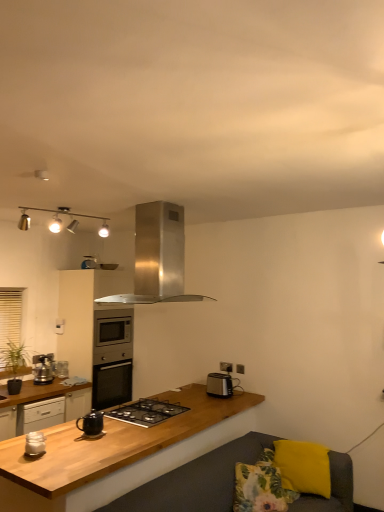
Question: Should I look upward or downward to see black glass gas stove at center?

Choices:
 (A) down
 (B) up

Answer: (A)

Question: Can you confirm if matte black kettle at center is positioned to the left of floral fabric pillow at lower right, which appears as the 2th pillow when viewed from the right?

Choices:
 (A) yes
 (B) no

Answer: (A)

Question: Does matte black kettle at center have a smaller size compared to floral fabric pillow at lower right, which appears as the 2th pillow when viewed from the right?

Choices:
 (A) no
 (B) yes

Answer: (B)

Question: Considering the relative sizes of matte black kettle at center and floral fabric pillow at lower right, which appears as the 2th pillow when viewed from the right, in the image provided, is matte black kettle at center thinner than floral fabric pillow at lower right, which appears as the 2th pillow when viewed from the right,?

Choices:
 (A) yes
 (B) no

Answer: (A)

Question: Is matte black kettle at center placed right next to floral fabric pillow at lower right, which appears as the 2th pillow when viewed from the right?

Choices:
 (A) no
 (B) yes

Answer: (A)

Question: Does matte black kettle at center appear on the right side of floral fabric pillow at lower right, which appears as the 2th pillow when viewed from the right?

Choices:
 (A) no
 (B) yes

Answer: (A)

Question: From the image's perspective, is matte black kettle at center on top of floral fabric pillow at lower right, marked as the first pillow in a left-to-right arrangement?

Choices:
 (A) yes
 (B) no

Answer: (A)

Question: Can you confirm if satin silver oven at center, which is counted as the second cabinetry, starting from the front, is positioned to the left of black glass gas stove at center?

Choices:
 (A) yes
 (B) no

Answer: (A)

Question: Can you confirm if satin silver oven at center, which is counted as the second cabinetry, starting from the front, is thinner than black glass gas stove at center?

Choices:
 (A) yes
 (B) no

Answer: (B)

Question: Is the depth of satin silver oven at center, which is counted as the second cabinetry, starting from the front, less than that of black glass gas stove at center?

Choices:
 (A) no
 (B) yes

Answer: (A)

Question: Considering the relative sizes of satin silver oven at center, which is counted as the second cabinetry, starting from the front, and black glass gas stove at center in the image provided, is satin silver oven at center, which is counted as the second cabinetry, starting from the front, smaller than black glass gas stove at center?

Choices:
 (A) yes
 (B) no

Answer: (B)

Question: From a real-world perspective, is satin silver oven at center, which is counted as the second cabinetry, starting from the front, positioned over black glass gas stove at center based on gravity?

Choices:
 (A) yes
 (B) no

Answer: (A)

Question: Is satin silver oven at center, which is counted as the second cabinetry, starting from the front, taller than black glass gas stove at center?

Choices:
 (A) yes
 (B) no

Answer: (A)

Question: Can you confirm if floral fabric pillow at lower right, marked as the first pillow in a left-to-right arrangement, is taller than yellow fabric pillow at lower right, positioned as the 2th pillow in left-to-right order?

Choices:
 (A) yes
 (B) no

Answer: (B)